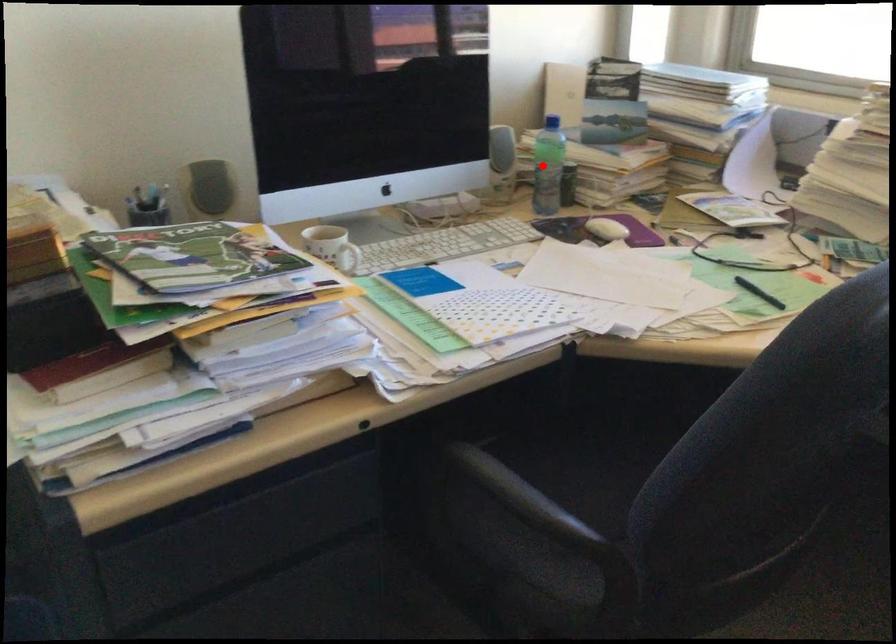
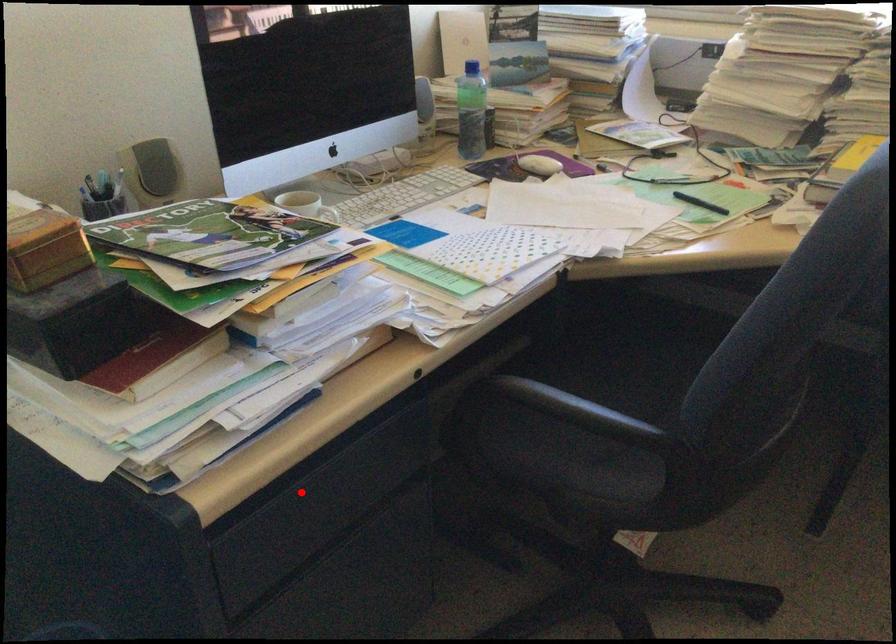
I am providing you with two images of the same scene from different viewpoints. A red point is marked on the first image and another point is marked on the second image. Do the highlighted points in image1 and image2 indicate the same real-world spot?

No